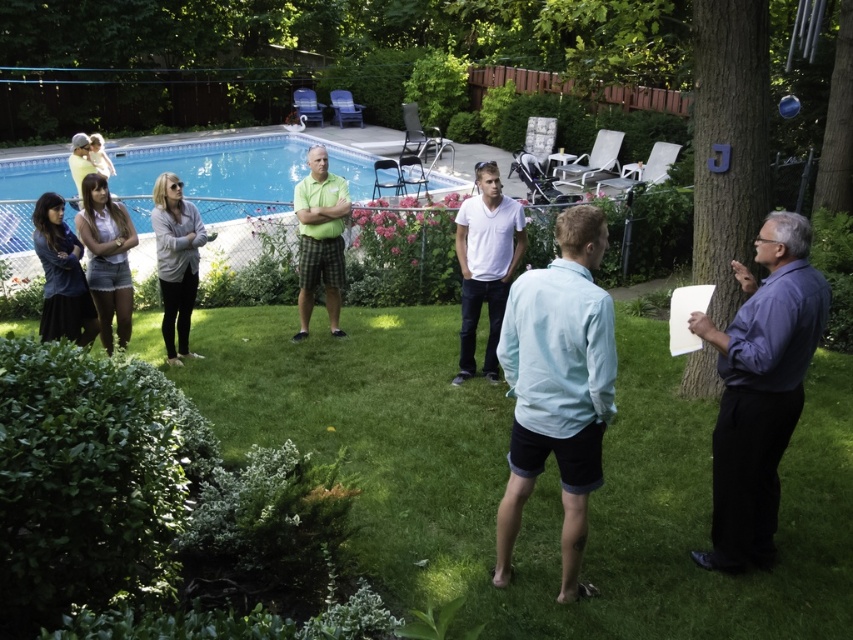
You are a photographer trying to capture a candid shot of the denim shorts at left and denim jacket at lower left. Since you want both items to be in focus, which one should you focus on first to ensure depth of field captures both?

The denim jacket at lower left is behind denim shorts at left, so you should focus on the denim jacket at lower left first to ensure both are in focus.

You are a gardener who needs to mow the green grass at center. However, there is a gray matte sweater at center in the way. Can you mow the grass without moving the sweater?

The green grass at center is shorter than the gray matte sweater at center, so the mower might hit the sweater if you try to mow without moving it. You should move the sweater first.

You are a photographer trying to capture a photo of the denim shorts at left and denim jacket at lower left. Based on their sizes, which object should you focus on first if you want to ensure both are in frame without moving the camera?

The denim shorts at left is taller than the denim jacket at lower left, so you should focus on the denim shorts at left first to ensure both fit in the frame.